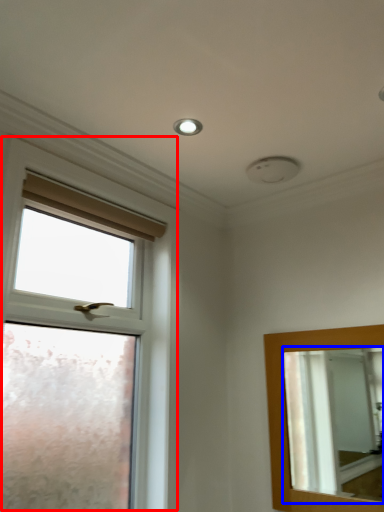
Question: Which object is closer to the camera taking this photo, window (highlighted by a red box) or mirror (highlighted by a blue box)?

Choices:
 (A) window
 (B) mirror

Answer: (A)